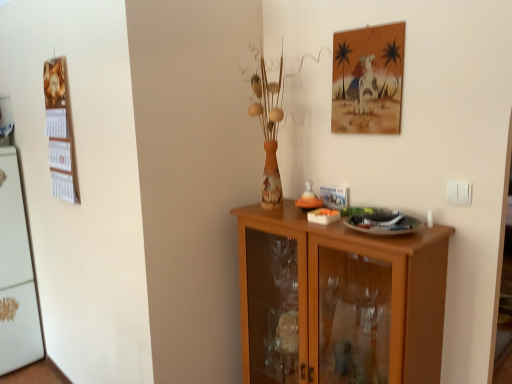
Question: Considering the relative positions of light brown wood cabinet at center and matte paper picture frame at upper right in the image provided, is light brown wood cabinet at center to the left or to the right of matte paper picture frame at upper right?

Choices:
 (A) right
 (B) left

Answer: (B)

Question: Considering the positions of point (344, 248) and point (374, 129), is point (344, 248) closer or farther from the camera than point (374, 129)?

Choices:
 (A) closer
 (B) farther

Answer: (A)

Question: Which object is the closest to the matte paper picture frame at upper right?

Choices:
 (A) wooden calendar at left
 (B) light brown wood cabinet at center
 (C) white matte refrigerator at left
 (D) white plastic switch at right

Answer: (D)

Question: Which of these objects is positioned closest to the white plastic switch at right?

Choices:
 (A) white matte refrigerator at left
 (B) light brown wood cabinet at center
 (C) matte paper picture frame at upper right
 (D) wooden calendar at left

Answer: (C)